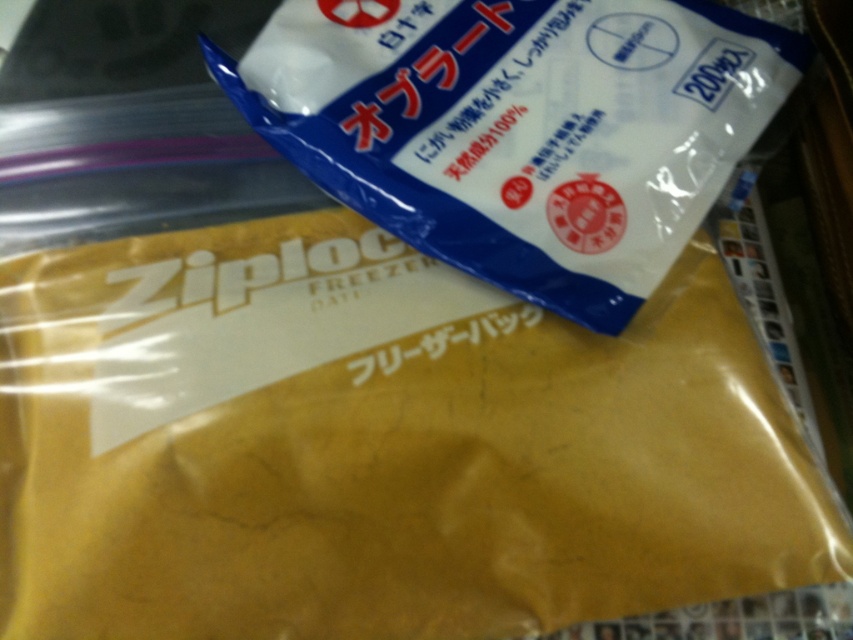
You are organizing items on a table and need to place a 10 inch ruler between the yellow matte ziploc bag at center and the blue paper bag at upper center. Can the ruler fit between them without overlapping either bag?

The distance between the yellow matte ziploc bag at center and the blue paper bag at upper center is 9.26 inches. Since the ruler is 10 inches long, it cannot fit between them without overlapping one of the bags.

You are standing 5 feet away from the surface where the two plastic bags are placed. Can you reach the point at coordinate point (x=250, y=616) without moving your position?

The distance between point (x=250, y=616) and the camera is 3.46 feet. Since you are standing 5 feet away from the surface, the point is within your reach as it is closer than your current distance.